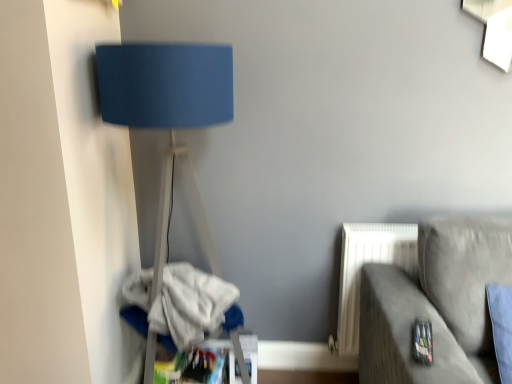
Question: From their relative heights in the image, would you say white cotton laundry at lower left is taller or shorter than suede gray couch at lower right?

Choices:
 (A) tall
 (B) short

Answer: (B)

Question: From the image's perspective, relative to suede gray couch at lower right, is white cotton laundry at lower left above or below?

Choices:
 (A) below
 (B) above

Answer: (B)

Question: Based on their relative distances, which object is farther from the suede gray couch at lower right?

Choices:
 (A) white cotton laundry at lower left
 (B) matte blue lampshade at left

Answer: (B)

Question: Which is nearer to the suede gray couch at lower right?

Choices:
 (A) matte blue lampshade at left
 (B) white cotton laundry at lower left

Answer: (B)